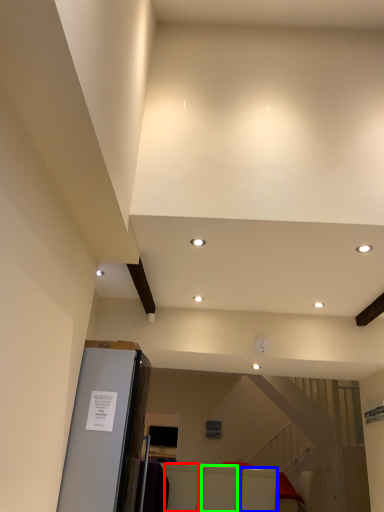
Question: Which is farther away from furniture (highlighted by a red box)? furniture (highlighted by a blue box) or furniture (highlighted by a green box)?

Choices:
 (A) furniture
 (B) furniture

Answer: (A)